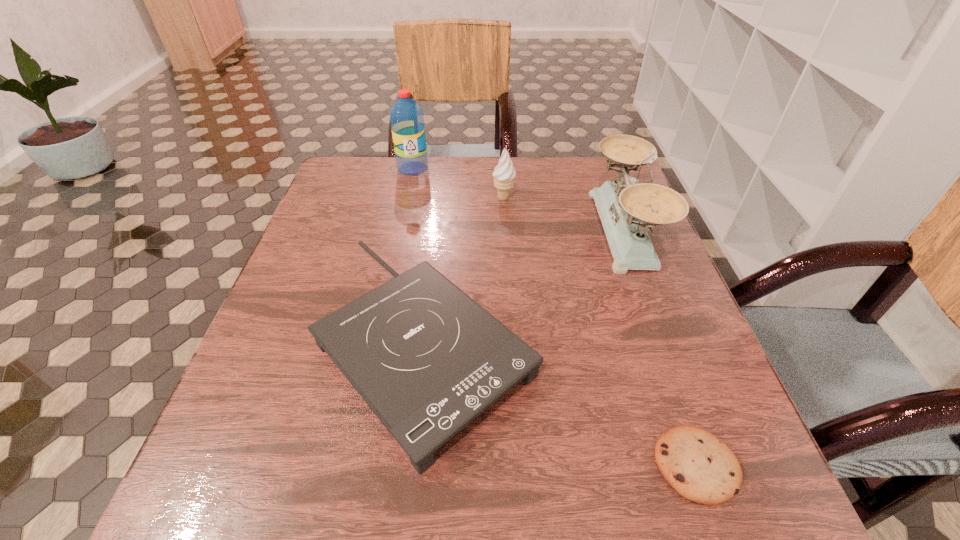
Where is `the second closest object to the scale`? the second closest object to the scale is located at coordinates (504, 173).

This screenshot has width=960, height=540. What are the coordinates of `object that is the closest to the cookie` in the screenshot? It's located at [x=427, y=359].

At what (x,y) coordinates should I click in order to perform the action: click on free spot that satisfies the following two spatial constraints: 1. on the front label of the cookie; 2. on the right side of the farthest object. Please return your answer as a coordinate pair (x, y). Image resolution: width=960 pixels, height=540 pixels. Looking at the image, I should click on (350, 465).

Where is `vacant space that satisfies the following two spatial constraints: 1. on the front-facing side of the cookie; 2. on the right side of the icecream`? The image size is (960, 540). vacant space that satisfies the following two spatial constraints: 1. on the front-facing side of the cookie; 2. on the right side of the icecream is located at coordinates (521, 465).